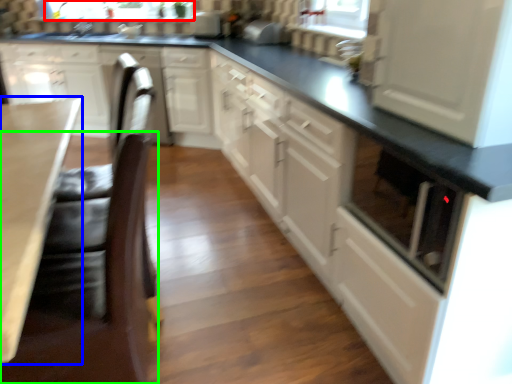
Question: Based on their relative distances, which object is farther from bay window (highlighted by a red box)? Choose from countertop (highlighted by a blue box) and swivel chair (highlighted by a green box).

Choices:
 (A) countertop
 (B) swivel chair

Answer: (B)